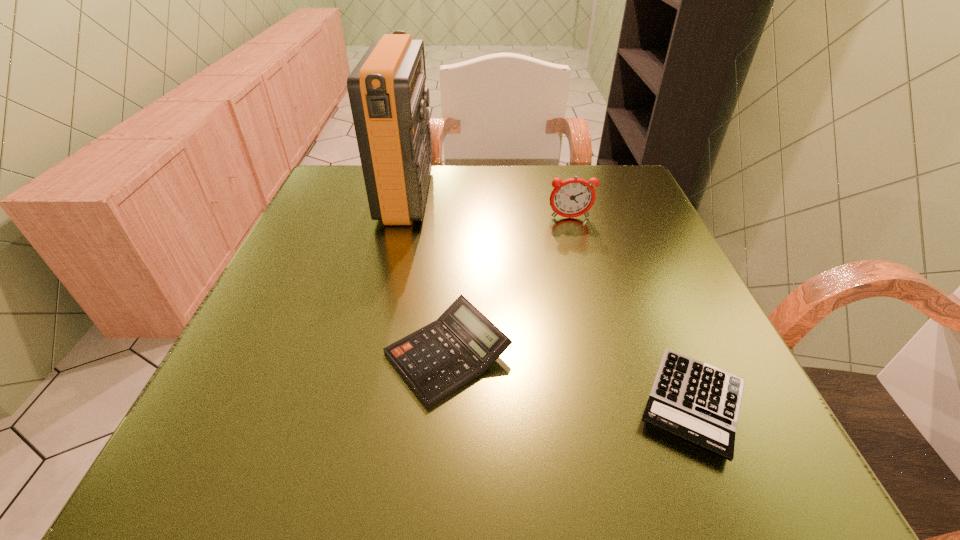
Identify the location of radio receiver. (388, 98).

I want to click on the third shortest object, so click(x=573, y=197).

The image size is (960, 540). I want to click on the second shortest object, so click(438, 359).

Image resolution: width=960 pixels, height=540 pixels. Find the location of `the taller calculator`. the taller calculator is located at coordinates (438, 359).

You are a GUI agent. You are given a task and a screenshot of the screen. Output one action in this format:
    pyautogui.click(x=<x>, y=<y>)
    Task: Click on the shorter calculator
    The image size is (960, 540).
    Given the screenshot: What is the action you would take?
    pyautogui.click(x=697, y=402)

The image size is (960, 540). Identify the location of the shortest object. (697, 402).

The width and height of the screenshot is (960, 540). Find the location of `free location located on the front-facing side of the tallest object`. free location located on the front-facing side of the tallest object is located at coordinates (460, 195).

Image resolution: width=960 pixels, height=540 pixels. I want to click on vacant region located 0.130m on the front-facing side of the third shortest object, so click(581, 258).

Where is `vacant space located 0.070m on the back of the third tallest object`? vacant space located 0.070m on the back of the third tallest object is located at coordinates (453, 282).

The height and width of the screenshot is (540, 960). What are the coordinates of `vacant space situated on the back of the right calculator` in the screenshot? It's located at (626, 241).